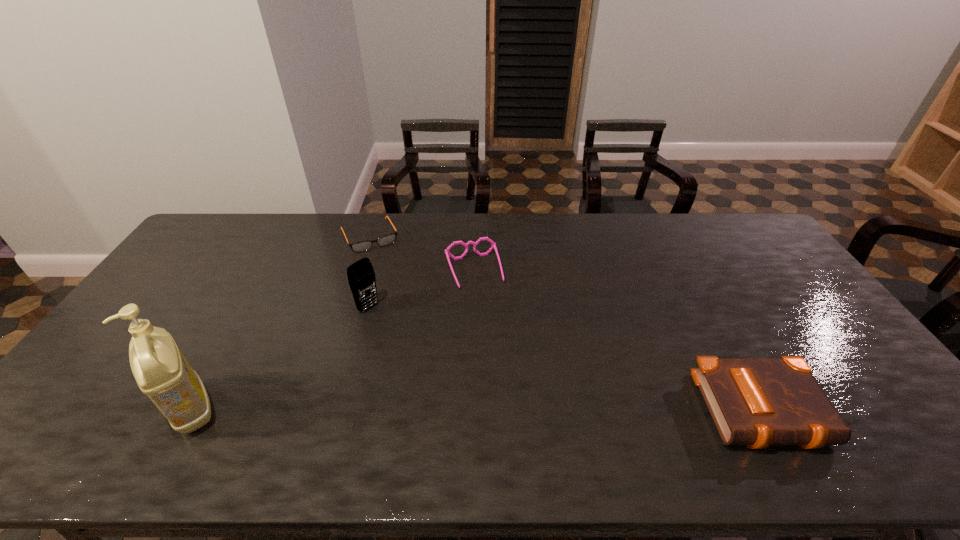
Locate an element on the screen. Image resolution: width=960 pixels, height=540 pixels. detergent at the near edge is located at coordinates (161, 371).

Where is `Bible at the near edge`? Image resolution: width=960 pixels, height=540 pixels. Bible at the near edge is located at coordinates (755, 402).

You are a GUI agent. You are given a task and a screenshot of the screen. Output one action in this format:
    pyautogui.click(x=<x>, y=<y>)
    Task: Click on the vacant space at the far edge of the desktop
    The height and width of the screenshot is (540, 960).
    Given the screenshot: What is the action you would take?
    pyautogui.click(x=474, y=219)

This screenshot has height=540, width=960. In order to click on vacant point at the near edge in this screenshot , I will do `click(298, 400)`.

The image size is (960, 540). I want to click on free point at the left edge, so click(202, 284).

In the image, there is a desktop. What are the coordinates of `vacant space at the right edge` in the screenshot? It's located at (827, 327).

The image size is (960, 540). In the image, there is a desktop. In order to click on vacant space at the far left corner in this screenshot , I will do `click(216, 228)`.

Image resolution: width=960 pixels, height=540 pixels. In the image, there is a desktop. In order to click on vacant space at the near left corner in this screenshot , I will do `click(110, 396)`.

In the image, there is a desktop. Where is `vacant space at the far right corner`? vacant space at the far right corner is located at coordinates (742, 233).

The height and width of the screenshot is (540, 960). In order to click on vacant space that's between the left spectacles and the taller spectacles in this screenshot , I will do `click(421, 254)`.